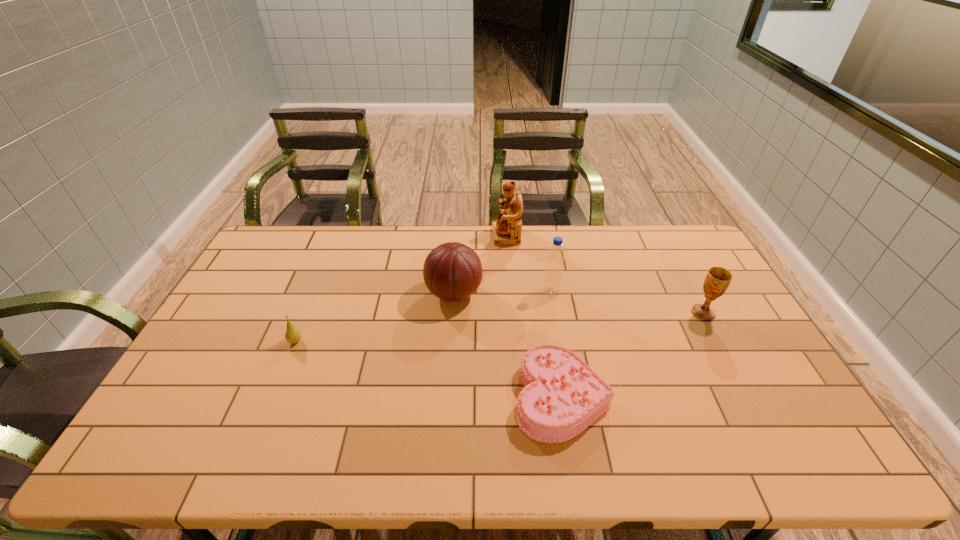
Image resolution: width=960 pixels, height=540 pixels. What are the coordinates of `vacant region between the rightmost object and the second shortest object` in the screenshot? It's located at (499, 327).

Find the location of a particular element. blank region between the basketball and the water bottle is located at coordinates (502, 293).

The image size is (960, 540). In order to click on free space between the farthest object and the water bottle in this screenshot , I will do `click(529, 264)`.

Choose which object is the fifth nearest neighbor to the second nearest object. Please provide its 2D coordinates. Your answer should be formatted as a tuple, i.e. [(x, y)], where the tuple contains the x and y coordinates of a point satisfying the conditions above.

[(718, 279)]

Locate which object ranks second in proximity to the figurine. Please provide its 2D coordinates. Your answer should be formatted as a tuple, i.e. [(x, y)], where the tuple contains the x and y coordinates of a point satisfying the conditions above.

[(555, 257)]

Where is `vacant space that satisfies the following two spatial constraints: 1. on the front-facing side of the farthest object; 2. on the left side of the third shortest object`? The image size is (960, 540). vacant space that satisfies the following two spatial constraints: 1. on the front-facing side of the farthest object; 2. on the left side of the third shortest object is located at coordinates (513, 313).

Where is `vacant space that satisfies the following two spatial constraints: 1. on the front-facing side of the farthest object; 2. on the right side of the nearest object`? This screenshot has width=960, height=540. vacant space that satisfies the following two spatial constraints: 1. on the front-facing side of the farthest object; 2. on the right side of the nearest object is located at coordinates (518, 396).

Where is `free spot that satisfies the following two spatial constraints: 1. on the front side of the nearest object; 2. on the left side of the basketball`? free spot that satisfies the following two spatial constraints: 1. on the front side of the nearest object; 2. on the left side of the basketball is located at coordinates (447, 396).

This screenshot has width=960, height=540. I want to click on free space that satisfies the following two spatial constraints: 1. on the front-facing side of the farthest object; 2. on the front side of the fifth object from right to left, so [x=511, y=294].

Locate an element on the screen. free spot that satisfies the following two spatial constraints: 1. on the front-facing side of the figurine; 2. on the right side of the rightmost object is located at coordinates (513, 313).